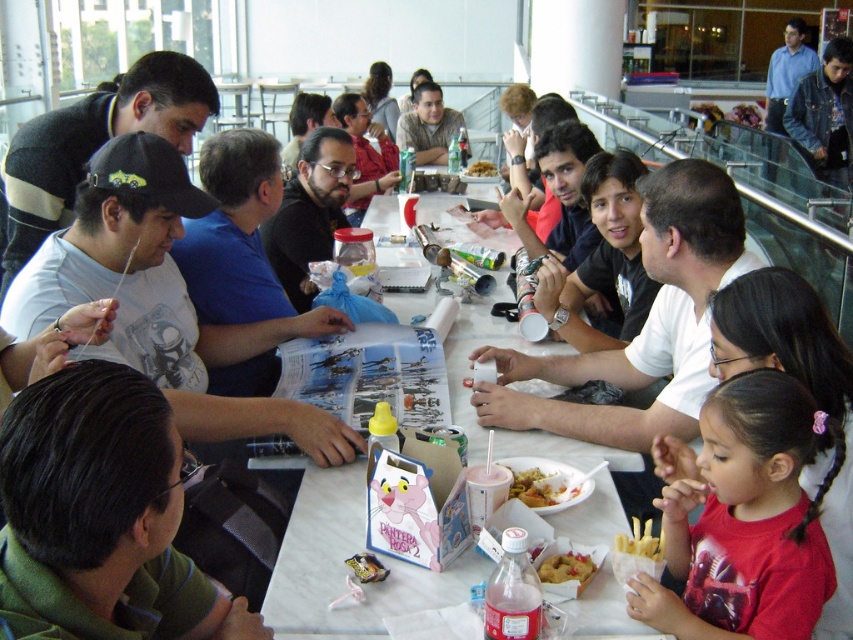
You are a server at the food court and need to deliver a drink to the person wearing the green fabric shirt at lower left. There is a shiny plastic cup at center on the table. Can you place the drink next to the cup without it being blocked by the shirt?

The green fabric shirt at lower left is taller than the shiny plastic cup at center, so placing the drink next to the cup might be obstructed by the shirt.

You are a server in the food court. You need to place a new order for a customer who is sitting at the white marble table at center. Where should you place the order so that it is in front of the brown paper bag at center?

The white marble table at center is in front of the brown paper bag at center, so you should place the new order on the white marble table at center in front of the brown paper bag at center to ensure it is accessible.